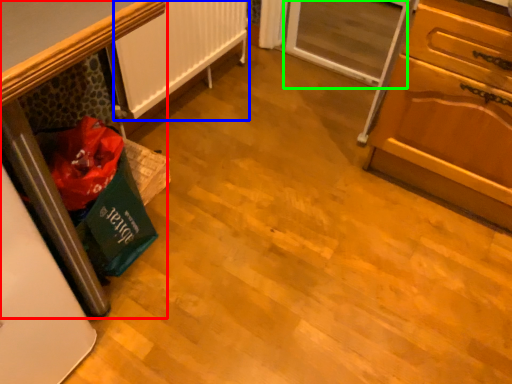
Question: Considering the real-world distances, which object is closest to furniture (highlighted by a red box)? radiator (highlighted by a blue box) or screen door (highlighted by a green box).

Choices:
 (A) radiator
 (B) screen door

Answer: (A)